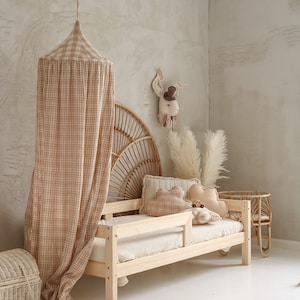
The width and height of the screenshot is (300, 300). I want to click on toddler bed, so click(x=169, y=237).